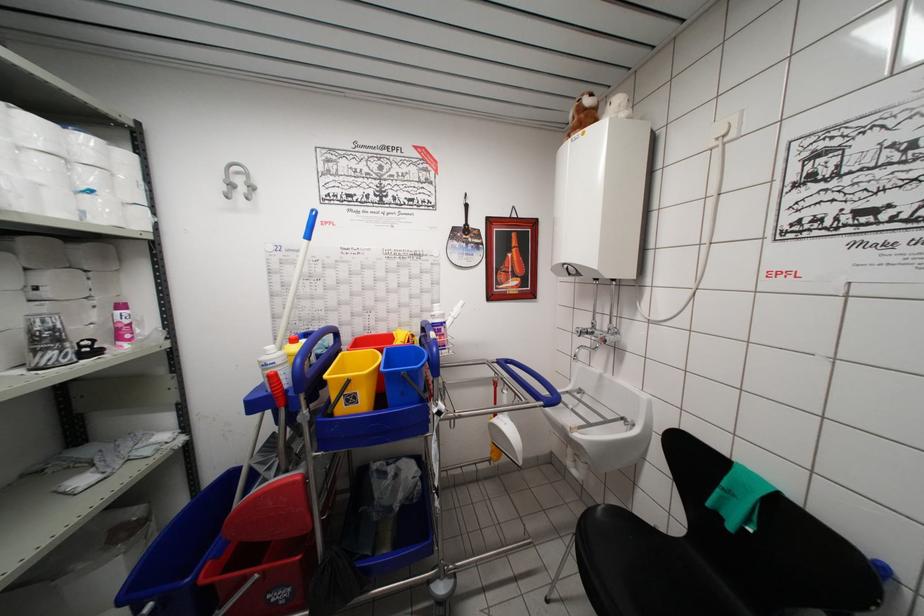
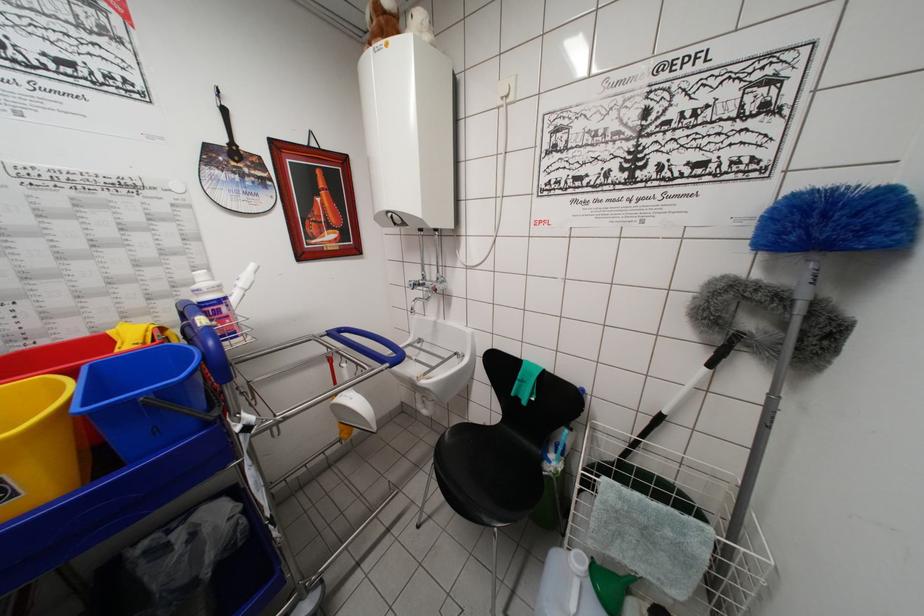
In the second image, find the point that corresponds to (x=416, y=339) in the first image.

(165, 333)